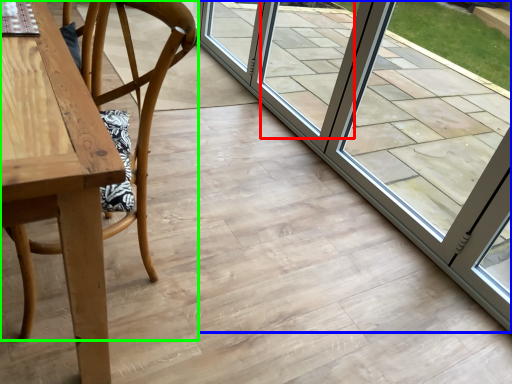
Question: Which is nearer to the window (highlighted by a red box)? door (highlighted by a blue box) or chair (highlighted by a green box).

Choices:
 (A) door
 (B) chair

Answer: (A)